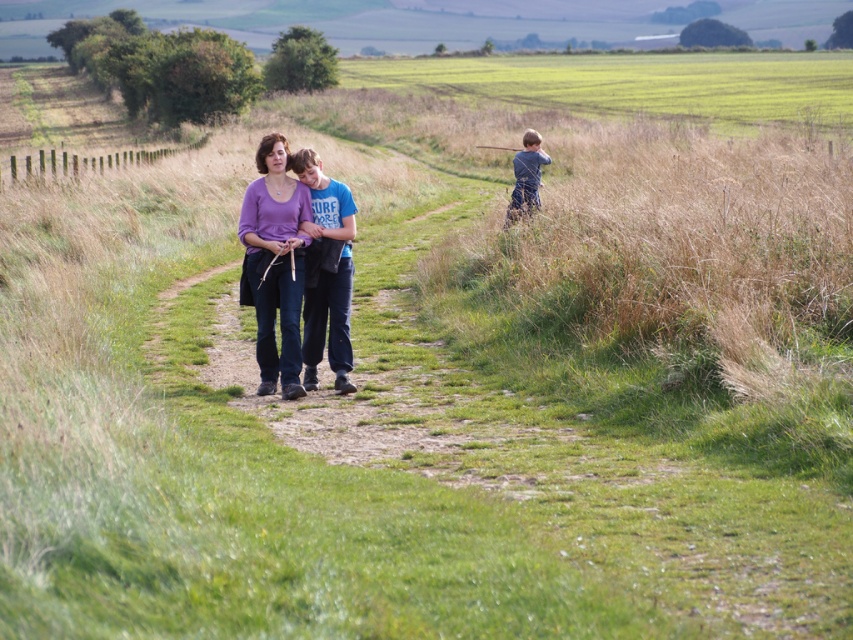
You are a photographer positioned at the origin point of the coordinate system. You want to take a photo of the purple matte shirt at center. What are the coordinates where you should aim your camera?

The coordinates to aim the camera are at point (274, 262).